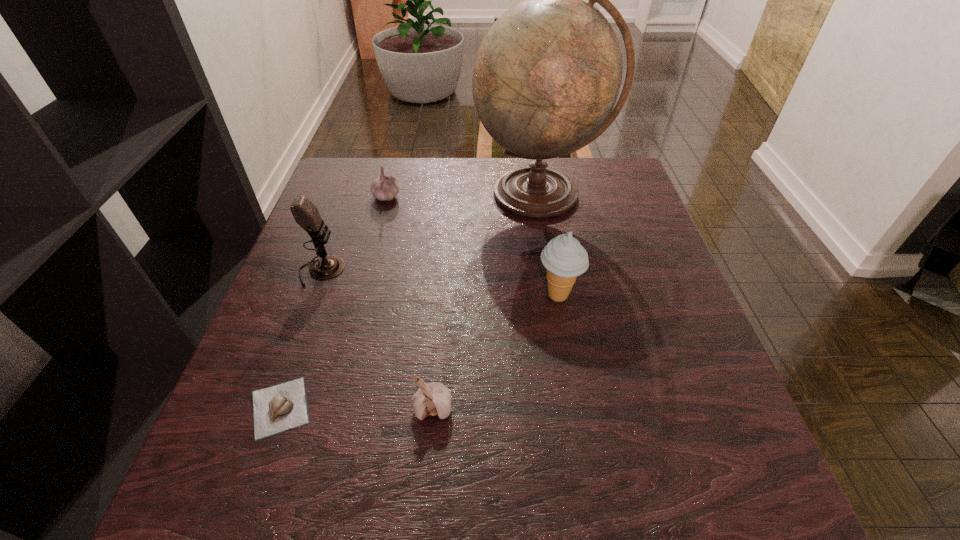
Find the location of a particular element. This screenshot has width=960, height=540. vacant space that satisfies the following two spatial constraints: 1. on the back side of the shortest object; 2. on the left side of the icecream is located at coordinates (320, 295).

This screenshot has width=960, height=540. What are the coordinates of `vacant point that satisfies the following two spatial constraints: 1. on the front-facing side of the globe; 2. on the right side of the icecream` in the screenshot? It's located at (557, 295).